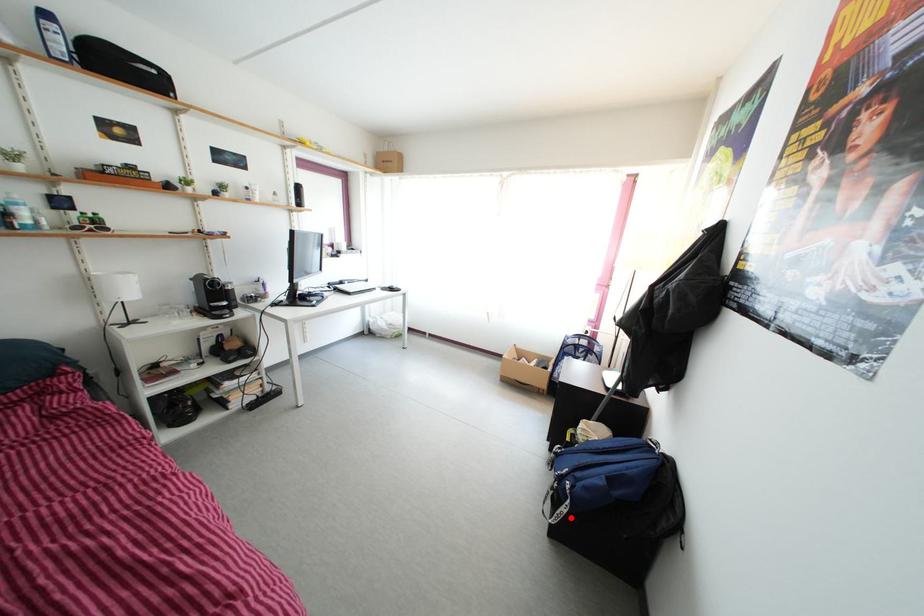
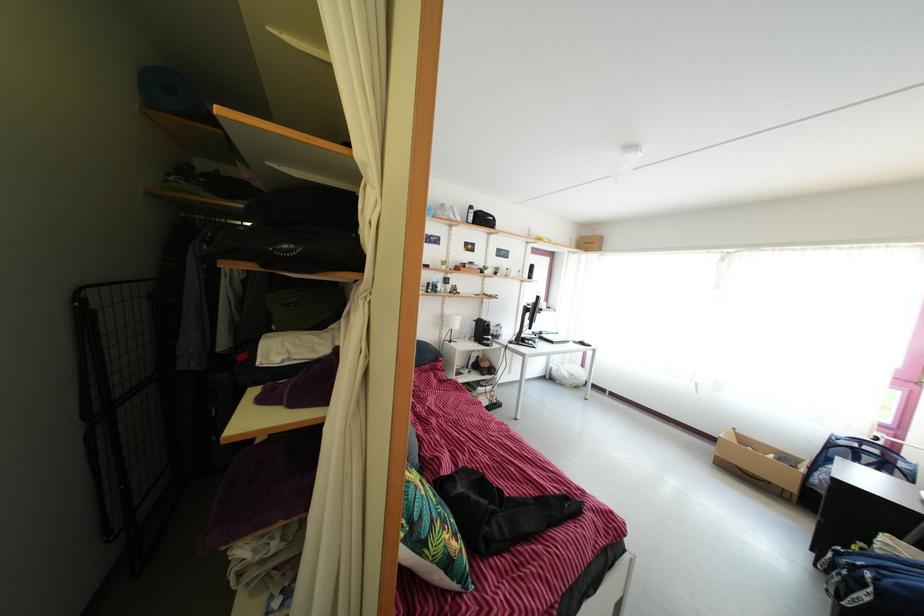
Question: A red point is marked in image1. In image2, is the corresponding 3D point closer to the camera or farther? Reply with the corresponding letter.

Choices:
 (A) The corresponding 3D point is closer.
 (B) The corresponding 3D point is farther.

Answer: (A)